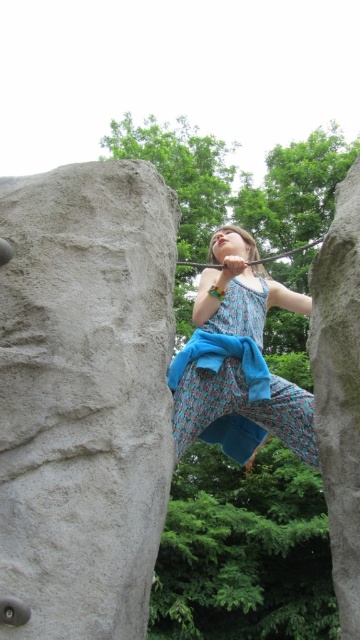
Question: Is gray rough rock at left thinner than floral dress at center?

Choices:
 (A) yes
 (B) no

Answer: (B)

Question: Among these points, which one is farthest from the camera?

Choices:
 (A) (285, 387)
 (B) (325, 435)

Answer: (A)

Question: Does floral dress at center appear on the left side of smooth gray rock at right?

Choices:
 (A) yes
 (B) no

Answer: (A)

Question: Does gray rough rock at left have a greater width compared to smooth gray rock at right?

Choices:
 (A) no
 (B) yes

Answer: (B)

Question: Which of these objects is positioned farthest from the smooth gray rock at right?

Choices:
 (A) floral dress at center
 (B) gray rough rock at left

Answer: (A)

Question: Which object is the closest to the smooth gray rock at right?

Choices:
 (A) floral dress at center
 (B) gray rough rock at left

Answer: (B)